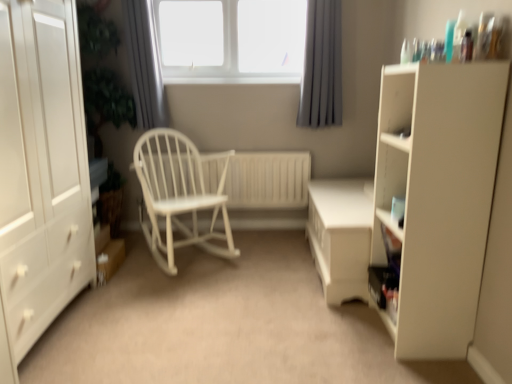
Question: Considering the relative positions of white wooden radiator at center and gray fabric curtain at upper center, the 1th curtain viewed from the left, in the image provided, is white wooden radiator at center to the left of gray fabric curtain at upper center, the 1th curtain viewed from the left, from the viewer's perspective?

Choices:
 (A) yes
 (B) no

Answer: (B)

Question: Is white wooden radiator at center smaller than gray fabric curtain at upper center, the 1th curtain viewed from the left?

Choices:
 (A) yes
 (B) no

Answer: (B)

Question: Is the surface of white wooden radiator at center in direct contact with gray fabric curtain at upper center, the 1th curtain viewed from the left?

Choices:
 (A) yes
 (B) no

Answer: (B)

Question: Is white wooden radiator at center not near gray fabric curtain at upper center, the 2th curtain viewed from the right?

Choices:
 (A) yes
 (B) no

Answer: (B)

Question: Considering the relative sizes of white wooden radiator at center and gray fabric curtain at upper center, the 1th curtain viewed from the left, in the image provided, is white wooden radiator at center taller than gray fabric curtain at upper center, the 1th curtain viewed from the left,?

Choices:
 (A) no
 (B) yes

Answer: (A)

Question: Is white wooden radiator at center behind gray fabric curtain at upper center, the 2th curtain viewed from the right?

Choices:
 (A) no
 (B) yes

Answer: (B)

Question: Is the position of white wood rocking chair at center less distant than that of white wooden radiator at center?

Choices:
 (A) no
 (B) yes

Answer: (B)

Question: From the image's perspective, is white wood rocking chair at center above white wooden radiator at center?

Choices:
 (A) no
 (B) yes

Answer: (A)

Question: Could you tell me if white wood rocking chair at center is facing white wooden radiator at center?

Choices:
 (A) no
 (B) yes

Answer: (A)

Question: Is white wood rocking chair at center outside white wooden radiator at center?

Choices:
 (A) yes
 (B) no

Answer: (A)

Question: From a real-world perspective, is white wood rocking chair at center positioned under white wooden radiator at center based on gravity?

Choices:
 (A) yes
 (B) no

Answer: (B)

Question: Can you confirm if white wood rocking chair at center is smaller than white wooden radiator at center?

Choices:
 (A) yes
 (B) no

Answer: (B)

Question: Is matte white cupboard at right smaller than white glossy table at center?

Choices:
 (A) no
 (B) yes

Answer: (B)